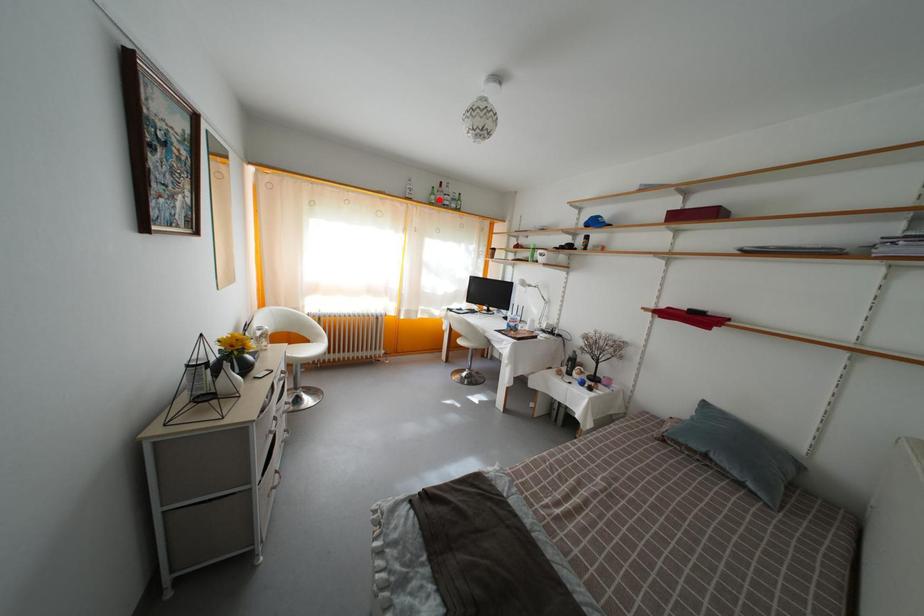
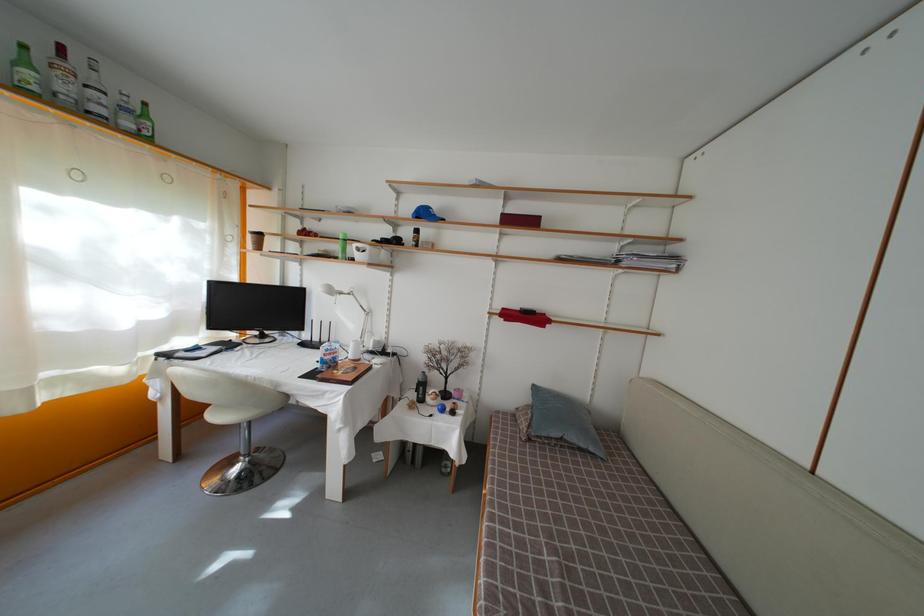
Question: A red point is marked in image1. In image2, is the corresponding 3D point closer to the camera or farther? Reply with the corresponding letter.

Choices:
 (A) The corresponding 3D point is closer.
 (B) The corresponding 3D point is farther.

Answer: (B)